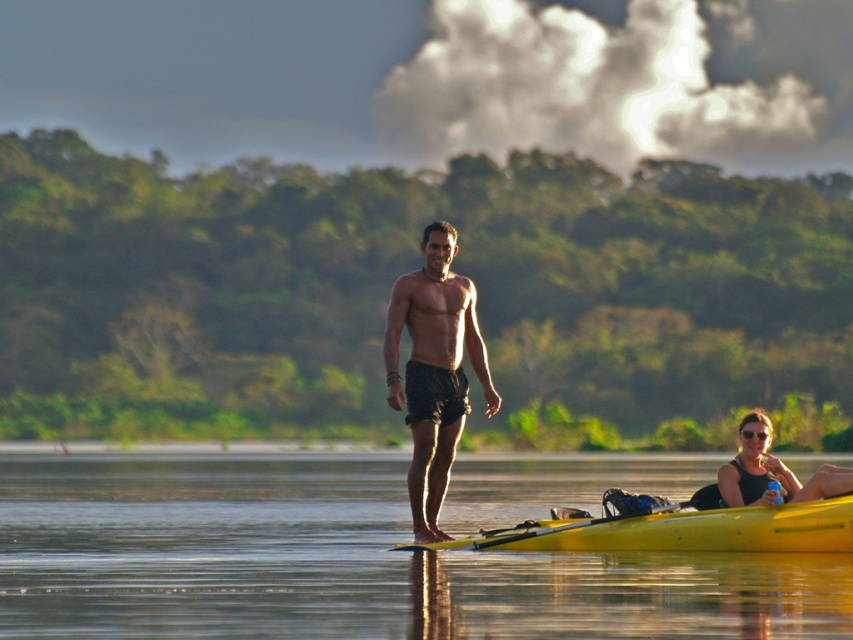
Can you confirm if black matte shorts at center is taller than yellow plastic paddle at lower center?

Correct, black matte shorts at center is much taller as yellow plastic paddle at lower center.

Is point (407, 298) positioned in front of point (489, 531)?

No.

Does point (410, 314) come farther from viewer compared to point (509, 540)?

Yes.

Image resolution: width=853 pixels, height=640 pixels. In order to click on black matte shorts at center in this screenshot , I will do `click(433, 369)`.

Does transparent water at center appear on the right side of matte black tank top at lower right?

No, transparent water at center is not to the right of matte black tank top at lower right.

How much distance is there between transparent water at center and matte black tank top at lower right?

transparent water at center is 26.38 feet away from matte black tank top at lower right.

This screenshot has height=640, width=853. Find the location of `transparent water at center`. transparent water at center is located at coordinates (344, 561).

The image size is (853, 640). I want to click on transparent water at center, so click(x=344, y=561).

Does yellow plastic kayak at center have a greater width compared to yellow plastic paddle at lower center?

Indeed, yellow plastic kayak at center has a greater width compared to yellow plastic paddle at lower center.

Does yellow plastic kayak at center appear under yellow plastic paddle at lower center?

Indeed, yellow plastic kayak at center is positioned under yellow plastic paddle at lower center.

Locate an element on the screen. The width and height of the screenshot is (853, 640). yellow plastic kayak at center is located at coordinates point(680,531).